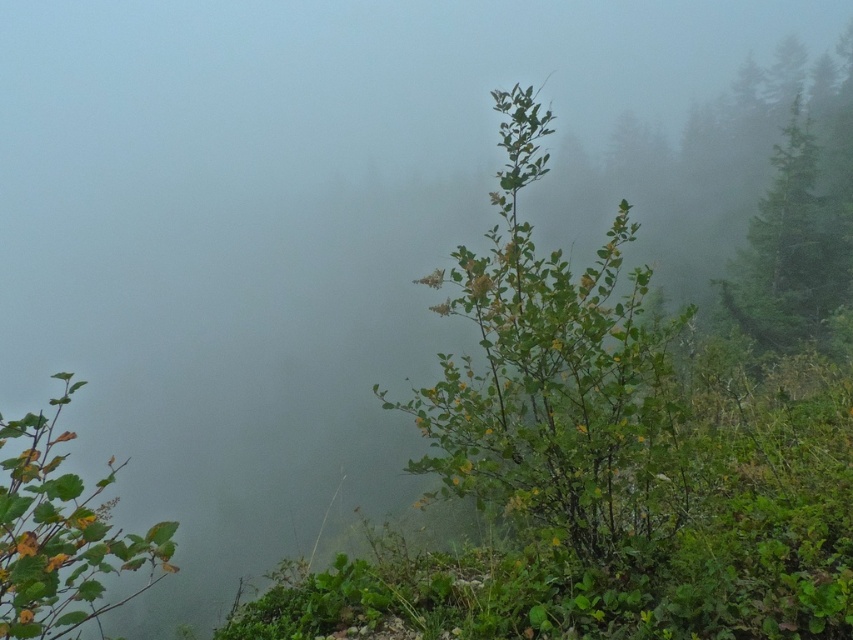
Question: Can you confirm if green leafy bush at center is thinner than green leafy shrub at lower left?

Choices:
 (A) no
 (B) yes

Answer: (B)

Question: Which object is closer to the camera taking this photo?

Choices:
 (A) green leafy tree at upper right
 (B) green leafy shrub at lower left
 (C) green leafy bush at center

Answer: (B)

Question: Is green leafy bush at center smaller than green leafy tree at upper right?

Choices:
 (A) yes
 (B) no

Answer: (A)

Question: Can you confirm if green leafy bush at center is smaller than green leafy shrub at lower left?

Choices:
 (A) yes
 (B) no

Answer: (A)

Question: Which point appears farthest from the camera in this image?

Choices:
 (A) (821, 260)
 (B) (485, 349)
 (C) (55, 636)

Answer: (A)

Question: Among these objects, which one is farthest from the camera?

Choices:
 (A) green leafy bush at center
 (B) green leafy shrub at lower left

Answer: (A)